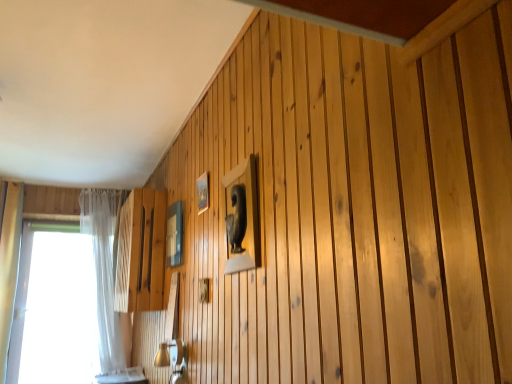
The height and width of the screenshot is (384, 512). What do you see at coordinates (104, 268) in the screenshot? I see `white sheer curtain at left` at bounding box center [104, 268].

Image resolution: width=512 pixels, height=384 pixels. What do you see at coordinates (63, 300) in the screenshot?
I see `transparent glass window at left` at bounding box center [63, 300].

This screenshot has height=384, width=512. Describe the element at coordinates (203, 192) in the screenshot. I see `wooden frame at upper center, marked as the 2th picture frame in a left-to-right arrangement` at that location.

Where is `white sheer curtain at left`? This screenshot has width=512, height=384. white sheer curtain at left is located at coordinates (104, 268).

Based on the photo, is wooden frame at upper center, marked as the 2th picture frame in a left-to-right arrangement, bigger than transparent glass window at left?

Actually, wooden frame at upper center, marked as the 2th picture frame in a left-to-right arrangement, might be smaller than transparent glass window at left.

In the scene shown: Is wooden frame at upper center, marked as the 2th picture frame in a left-to-right arrangement, wider than transparent glass window at left?

Incorrect, the width of wooden frame at upper center, marked as the 2th picture frame in a left-to-right arrangement, does not surpass that of transparent glass window at left.

Based on the photo, is transparent glass window at left completely or partially inside wooden frame at upper center, the 1th picture frame positioned from the right?

That's incorrect, transparent glass window at left is not inside wooden frame at upper center, the 1th picture frame positioned from the right.

Considering the relative positions of wooden frame at upper center, the 1th picture frame positioned from the right, and transparent glass window at left in the image provided, is wooden frame at upper center, the 1th picture frame positioned from the right, behind transparent glass window at left?

No, wooden frame at upper center, the 1th picture frame positioned from the right, is closer to the camera.

Which of these two, matte glass picture frame at upper center, which ranks as the 1th picture frame in left-to-right order, or transparent glass window at left, is wider?

With larger width is transparent glass window at left.

From the image's perspective, starting from the transparent glass window at left, which picture frame is the 1st one above? Please provide its 2D coordinates.

[(174, 235)]

From the image's perspective, would you say matte glass picture frame at upper center, which ranks as the 1th picture frame in left-to-right order, is shown under transparent glass window at left?

Incorrect, from the image's perspective, matte glass picture frame at upper center, which ranks as the 1th picture frame in left-to-right order, is higher than transparent glass window at left.

Can you confirm if matte glass picture frame at upper center, which ranks as the 1th picture frame in left-to-right order, is smaller than transparent glass window at left?

Correct, matte glass picture frame at upper center, which ranks as the 1th picture frame in left-to-right order, occupies less space than transparent glass window at left.

Is the position of matte glass picture frame at upper center, acting as the second picture frame starting from the right, more distant than that of white sheer curtain at left?

No, matte glass picture frame at upper center, acting as the second picture frame starting from the right, is closer to the camera.

Is matte glass picture frame at upper center, which ranks as the 1th picture frame in left-to-right order, not inside white sheer curtain at left?

That's correct, matte glass picture frame at upper center, which ranks as the 1th picture frame in left-to-right order, is outside of white sheer curtain at left.

Considering the relative sizes of matte glass picture frame at upper center, arranged as the first picture frame when viewed from the back, and white sheer curtain at left in the image provided, is matte glass picture frame at upper center, arranged as the first picture frame when viewed from the back, wider than white sheer curtain at left?

In fact, matte glass picture frame at upper center, arranged as the first picture frame when viewed from the back, might be narrower than white sheer curtain at left.

Between point (109, 254) and point (95, 360), which one is positioned in front?

Point (109, 254)

Would you say white sheer curtain at left is inside or outside transparent glass window at left?

white sheer curtain at left is located beyond the bounds of transparent glass window at left.

In the scene shown: What's the angular difference between white sheer curtain at left and transparent glass window at left's facing directions?

0.304 degrees.

Which object is wider, white sheer curtain at left or transparent glass window at left?

With larger width is white sheer curtain at left.

From the image's perspective, which object appears higher, transparent glass window at left or white sheer curtain at left?

white sheer curtain at left is shown above in the image.

Does transparent glass window at left turn towards white sheer curtain at left?

No, transparent glass window at left is not turned towards white sheer curtain at left.

From a real-world perspective, is transparent glass window at left over white sheer curtain at left?

No, from a real-world perspective, transparent glass window at left is not above white sheer curtain at left.

Can you confirm if transparent glass window at left is bigger than matte glass picture frame at upper center, acting as the second picture frame starting from the right?

Yes, transparent glass window at left is bigger than matte glass picture frame at upper center, acting as the second picture frame starting from the right.

From a real-world perspective, is transparent glass window at left physically below matte glass picture frame at upper center, which is the 2th picture frame in front-to-back order?

Correct, in the physical world, transparent glass window at left is lower than matte glass picture frame at upper center, which is the 2th picture frame in front-to-back order.

Is transparent glass window at left closer to camera compared to matte glass picture frame at upper center, acting as the second picture frame starting from the right?

No, transparent glass window at left is further to the viewer.

Which object is positioned more to the right, wooden frame at upper center, the 1th picture frame positioned from the right, or matte glass picture frame at upper center, which is the 2th picture frame in front-to-back order?

wooden frame at upper center, the 1th picture frame positioned from the right.

Considering the points (202, 210) and (177, 263), which point is in front, point (202, 210) or point (177, 263)?

The point (202, 210) is closer.

Find the location of a particular element. window on the left of wooden frame at upper center, marked as the 2th picture frame in a left-to-right arrangement is located at coordinates (63, 300).

At what (x,y) coordinates should I click in order to perform the action: click on the 1st picture frame directly above the transparent glass window at left (from a real-world perspective). Please return your answer as a coordinate pair (x, y). The height and width of the screenshot is (384, 512). Looking at the image, I should click on (174, 235).

Which object lies further to the anchor point wooden frame at upper center, which ranks as the 2th picture frame in back-to-front order, white sheer curtain at left or matte glass picture frame at upper center, which is the 2th picture frame in front-to-back order?

Among the two, white sheer curtain at left is located further to wooden frame at upper center, which ranks as the 2th picture frame in back-to-front order.

Considering their positions, is wooden frame at upper center, the 1th picture frame positioned from the front, positioned further to white sheer curtain at left than matte glass picture frame at upper center, acting as the second picture frame starting from the right?

wooden frame at upper center, the 1th picture frame positioned from the front, lies further to white sheer curtain at left than the other object.

When comparing their distances from transparent glass window at left, does white sheer curtain at left or matte glass picture frame at upper center, which ranks as the 1th picture frame in left-to-right order, seem closer?

white sheer curtain at left is closer to transparent glass window at left.

From the image, which object appears to be nearer to matte glass picture frame at upper center, acting as the second picture frame starting from the right, wooden frame at upper center, the 1th picture frame positioned from the right, or white sheer curtain at left?

wooden frame at upper center, the 1th picture frame positioned from the right, is positioned closer to the anchor matte glass picture frame at upper center, acting as the second picture frame starting from the right.

From the image, which object appears to be nearer to white sheer curtain at left, matte glass picture frame at upper center, acting as the second picture frame starting from the right, or wooden frame at upper center, the 1th picture frame positioned from the front?

Based on the image, matte glass picture frame at upper center, acting as the second picture frame starting from the right, appears to be nearer to white sheer curtain at left.

When comparing their distances from wooden frame at upper center, marked as the 2th picture frame in a left-to-right arrangement, does matte glass picture frame at upper center, arranged as the first picture frame when viewed from the back, or white sheer curtain at left seem further?

Based on the image, white sheer curtain at left appears to be further to wooden frame at upper center, marked as the 2th picture frame in a left-to-right arrangement.

Estimate the real-world distances between objects in this image. Which object is further from matte glass picture frame at upper center, which ranks as the 1th picture frame in left-to-right order, transparent glass window at left or white sheer curtain at left?

transparent glass window at left is further to matte glass picture frame at upper center, which ranks as the 1th picture frame in left-to-right order.

From the image, which object appears to be nearer to white sheer curtain at left, matte glass picture frame at upper center, acting as the second picture frame starting from the right, or transparent glass window at left?

Based on the image, transparent glass window at left appears to be nearer to white sheer curtain at left.

I want to click on curtain between wooden frame at upper center, which ranks as the 2th picture frame in back-to-front order, and transparent glass window at left, along the z-axis, so click(104, 268).

In order to click on picture frame between transparent glass window at left and wooden frame at upper center, the 1th picture frame positioned from the right, from left to right in this screenshot , I will do `click(174, 235)`.

Image resolution: width=512 pixels, height=384 pixels. What are the coordinates of `picture frame between wooden frame at upper center, the 1th picture frame positioned from the front, and white sheer curtain at left, along the z-axis` in the screenshot? It's located at (174, 235).

The width and height of the screenshot is (512, 384). In order to click on curtain between transparent glass window at left and matte glass picture frame at upper center, which is the 2th picture frame in front-to-back order in this screenshot , I will do `click(104, 268)`.